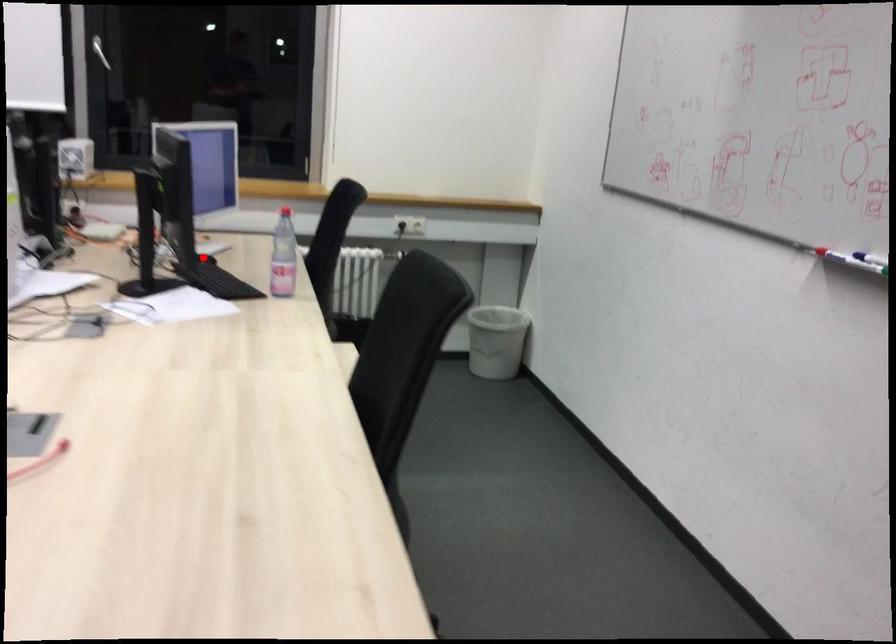
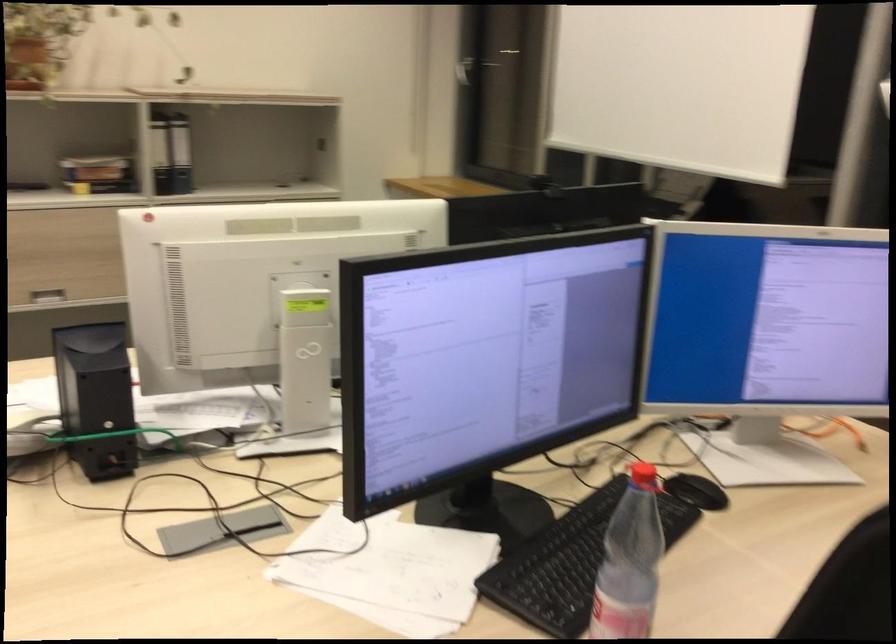
The point at the highlighted location is marked in the first image. Where is the corresponding point in the second image?

(695, 491)